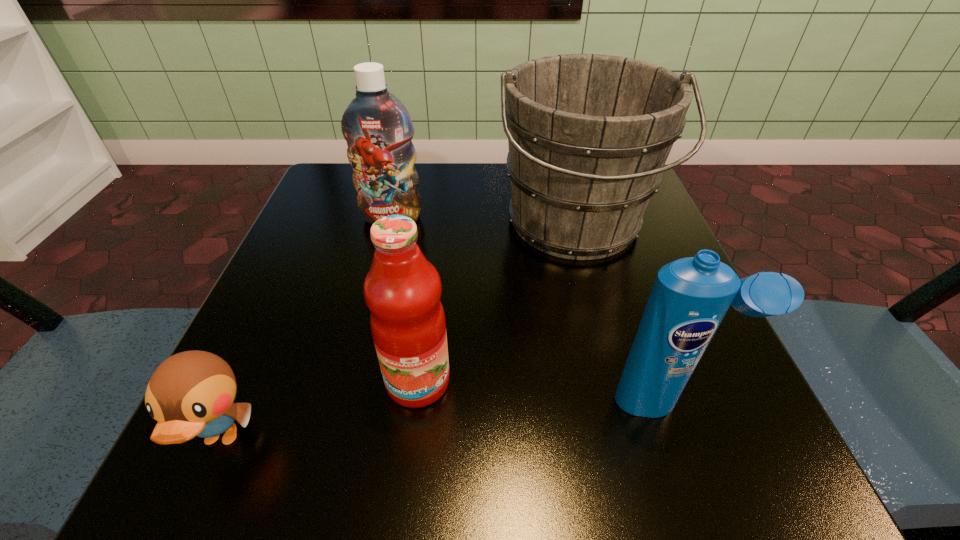
Where is `shampoo that is at the far edge`? shampoo that is at the far edge is located at coordinates (377, 127).

At what (x,y) coordinates should I click in order to perform the action: click on bucket at the far edge. Please return your answer as a coordinate pair (x, y). The height and width of the screenshot is (540, 960). Looking at the image, I should click on (588, 134).

The image size is (960, 540). I want to click on shampoo located in the near edge section of the desktop, so tap(690, 297).

This screenshot has height=540, width=960. I want to click on duck present at the near edge, so click(191, 393).

The image size is (960, 540). In order to click on shampoo situated at the left edge in this screenshot , I will do click(377, 127).

Identify the location of duck that is at the left edge. (191, 393).

Where is `bucket situated at the right edge`? The width and height of the screenshot is (960, 540). bucket situated at the right edge is located at coordinates (588, 134).

Where is `shampoo that is positioned at the right edge`? shampoo that is positioned at the right edge is located at coordinates (690, 297).

Identify the location of object present at the far left corner. The height and width of the screenshot is (540, 960). (377, 127).

The height and width of the screenshot is (540, 960). In order to click on object present at the near left corner in this screenshot , I will do `click(191, 393)`.